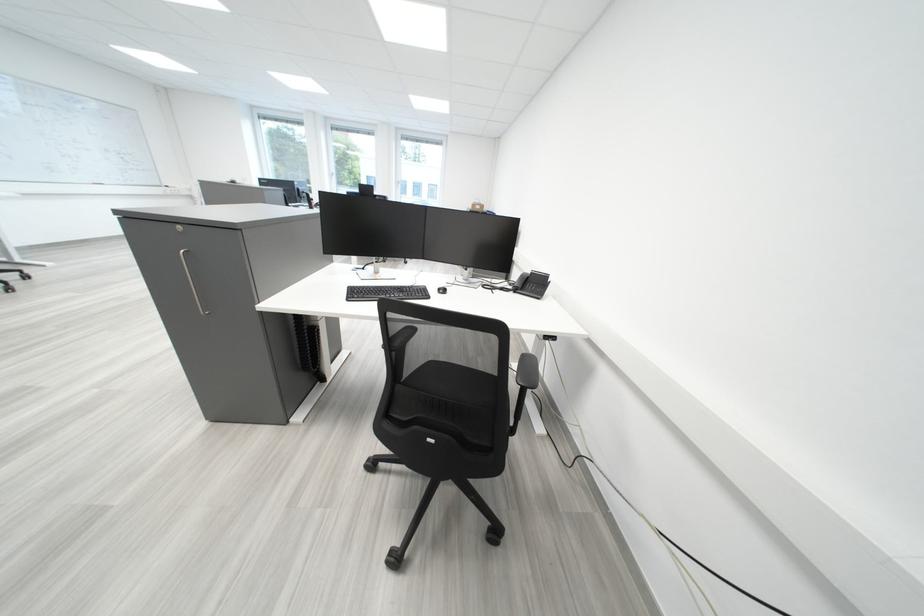
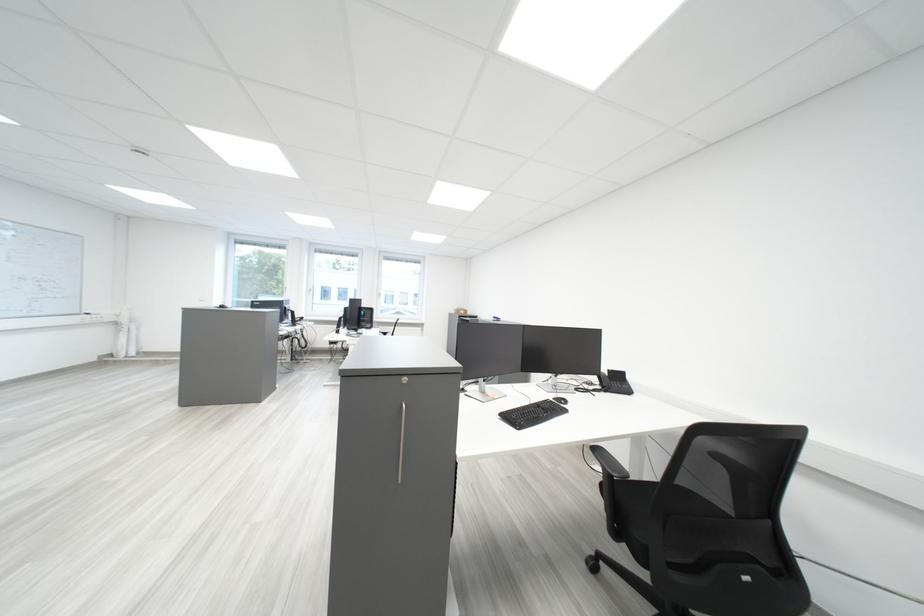
The point at (x=548, y=286) is marked in the first image. Where is the corresponding point in the second image?

(629, 384)